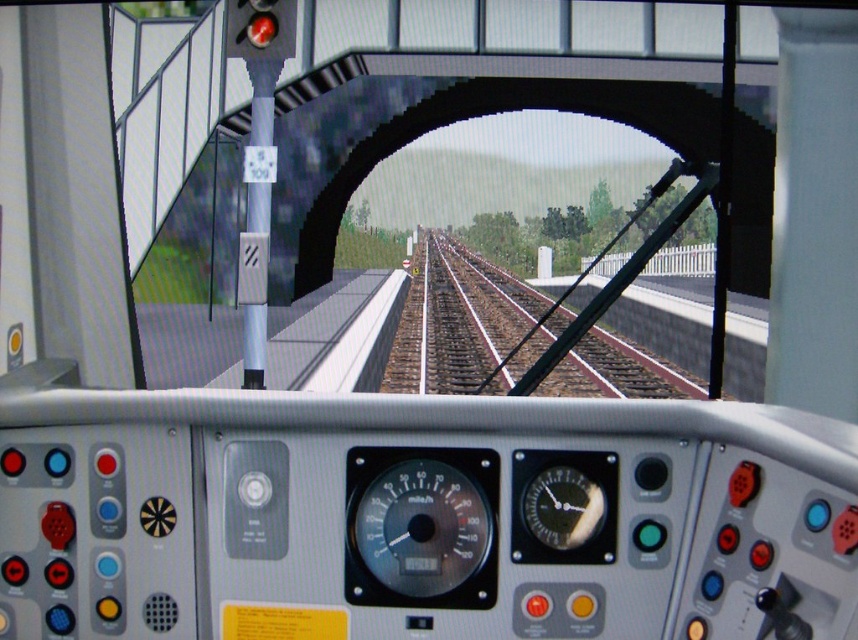
You are operating a train and need to check the central gauge to ensure the train is stationary. Where exactly is the matte black gauge at center positioned in the control panel?

The matte black gauge at center is located at point (420, 528), so it is positioned there on the control panel.

You are operating a train and need to adjust the controls. You notice two points in your view through the windshield. The first point is at coordinates point (434, 454) and the second is at point (511, 328). Which point is closer to you?

Point (434, 454) is closer to the viewer than point (511, 328).